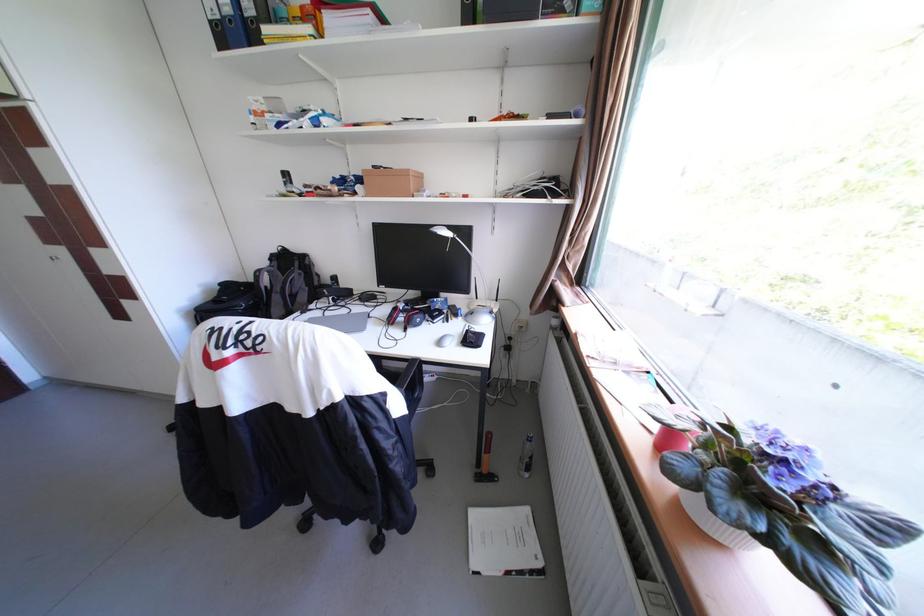
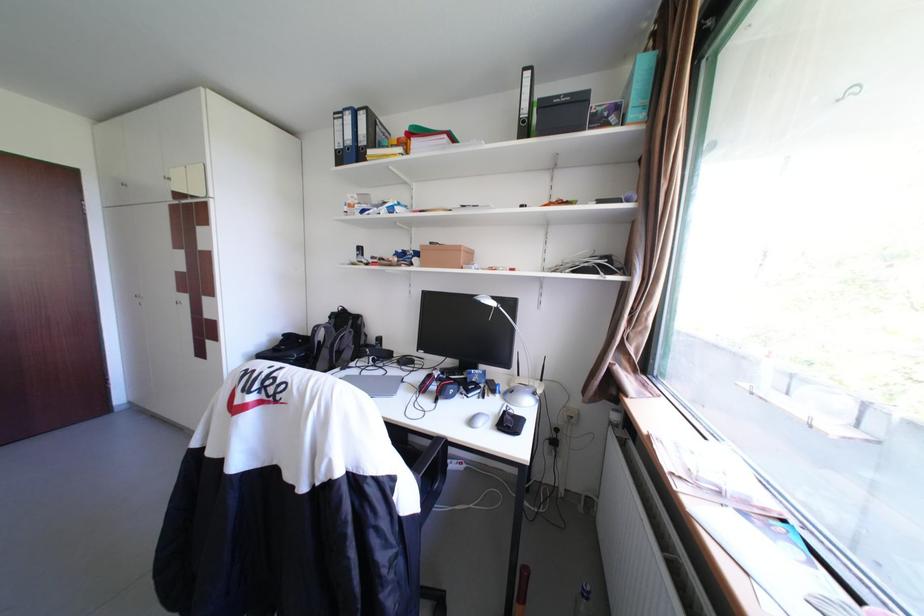
The point at [482,307] is marked in the first image. Where is the corresponding point in the second image?

(523, 386)